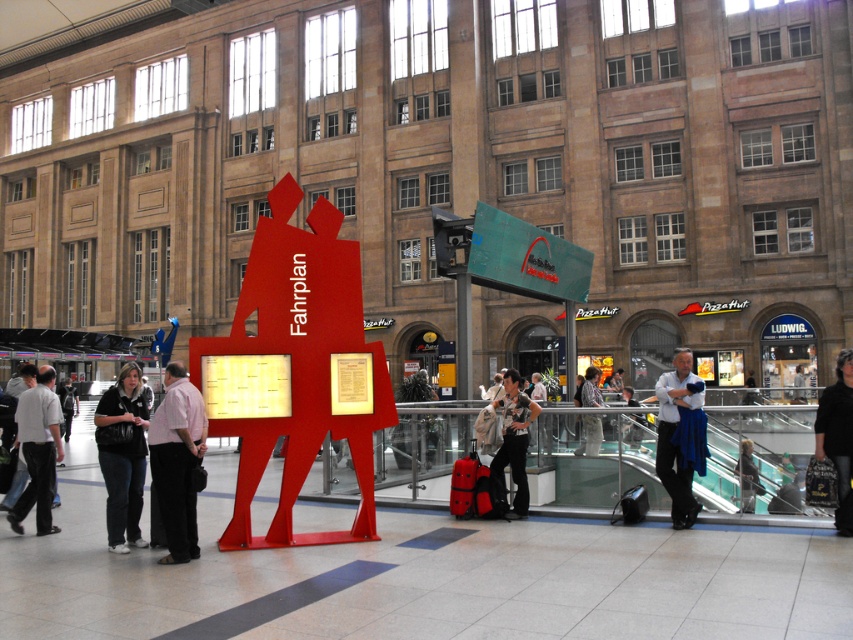
Can you confirm if black leather jacket at lower left is shorter than striped shirt at center?

No, black leather jacket at lower left is not shorter than striped shirt at center.

Can you confirm if black leather jacket at lower left is wider than striped shirt at center?

No, black leather jacket at lower left is not wider than striped shirt at center.

Is point (129, 445) farther from viewer compared to point (599, 417)?

No, (129, 445) is closer to viewer.

The image size is (853, 640). I want to click on black leather jacket at lower left, so click(123, 458).

Who is taller, pink shirt at center or black leather jacket at lower left?

pink shirt at center is taller.

Who is more forward, (157, 445) or (129, 508)?

Positioned in front is point (157, 445).

You are a GUI agent. You are given a task and a screenshot of the screen. Output one action in this format:
    pyautogui.click(x=<x>, y=<y>)
    Task: Click on the pink shirt at center
    
    Given the screenshot: What is the action you would take?
    point(177,461)

Is point (659, 397) farther from viewer compared to point (636, 444)?

No.

Is white shirt at center smaller than dark blue jeans at center?

Indeed, white shirt at center has a smaller size compared to dark blue jeans at center.

The height and width of the screenshot is (640, 853). I want to click on white shirt at center, so coord(675,433).